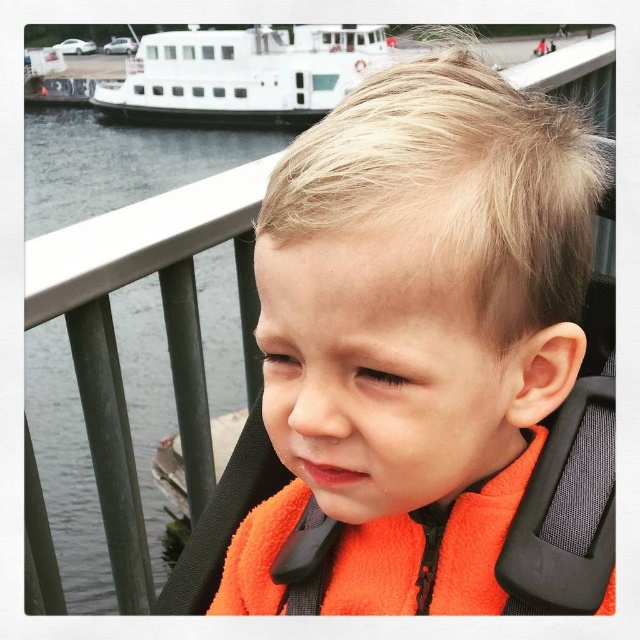
Who is higher up, transparent water at left or white matte boat at upper left?

white matte boat at upper left is higher up.

Locate an element on the screen. The image size is (640, 640). transparent water at left is located at coordinates (116, 163).

Does orange fabric at center appear under transparent water at left?

Yes.

Between orange fabric at center and transparent water at left, which one is positioned higher?

transparent water at left is higher up.

Locate an element on the screen. The height and width of the screenshot is (640, 640). orange fabric at center is located at coordinates (416, 332).

Between point (307, 380) and point (241, 102), which one is positioned behind?

The point (241, 102) is more distant.

Between orange fabric at center and white matte boat at upper left, which one is positioned higher?

white matte boat at upper left is above.

Which is in front, point (484, 422) or point (221, 124)?

Point (484, 422)

Locate an element on the screen. The height and width of the screenshot is (640, 640). orange fabric at center is located at coordinates (416, 332).